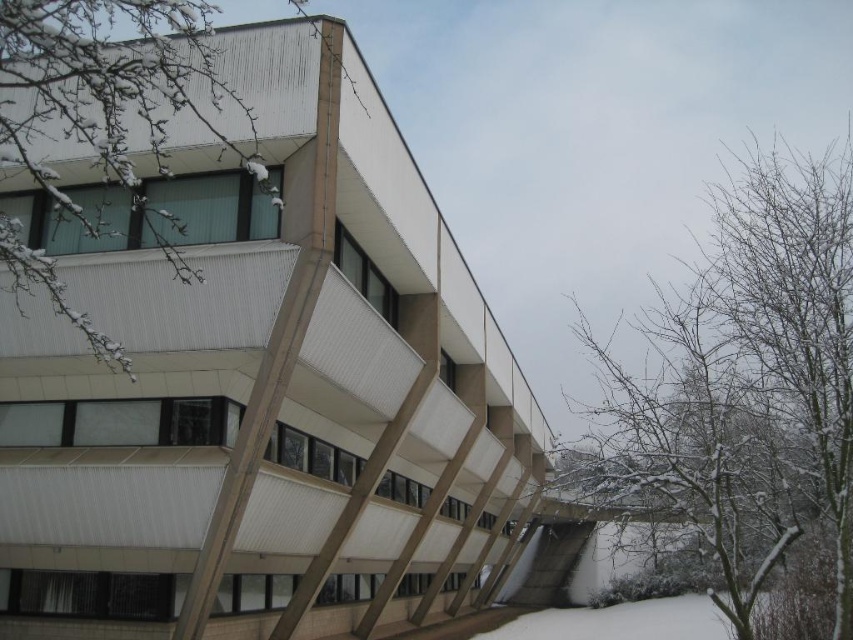
Is snow-covered branches at upper right positioned before snow-covered branches at upper left?

No, snow-covered branches at upper right is behind snow-covered branches at upper left.

Is snow-covered branches at upper right above snow-covered branches at upper left?

Incorrect, snow-covered branches at upper right is not positioned above snow-covered branches at upper left.

Is point (679, 422) closer to camera compared to point (90, 348)?

No, it is not.

What are the coordinates of `snow-covered branches at upper right` in the screenshot? It's located at (746, 388).